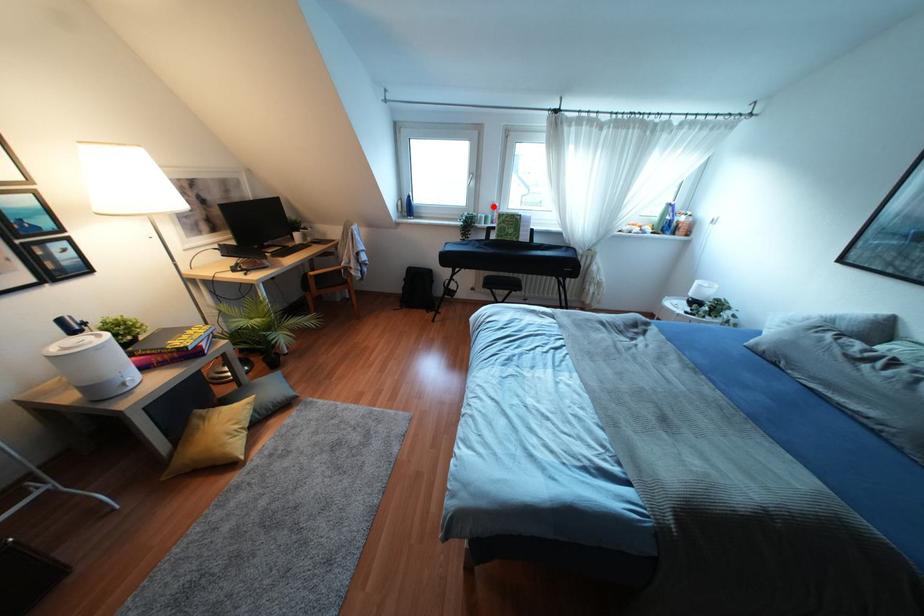
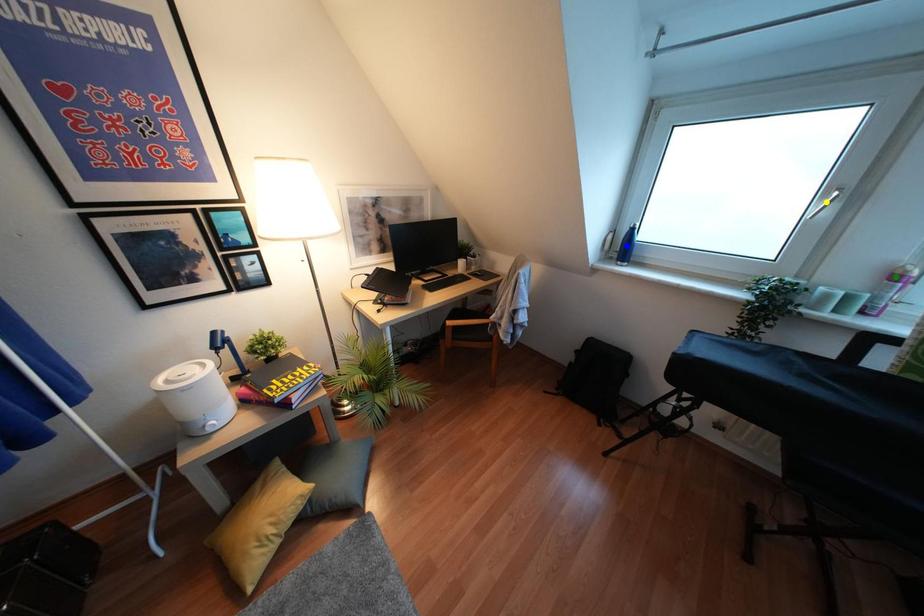
Question: I am providing you with two images of the same scene from different viewpoints. A red point is marked on the first image. You are given multiple points on the second image. Which point in image 2 is actually the same real-world point as the red point in image 1?

Choices:
 (A) yellow point
 (B) blue point
 (C) green point

Answer: (C)